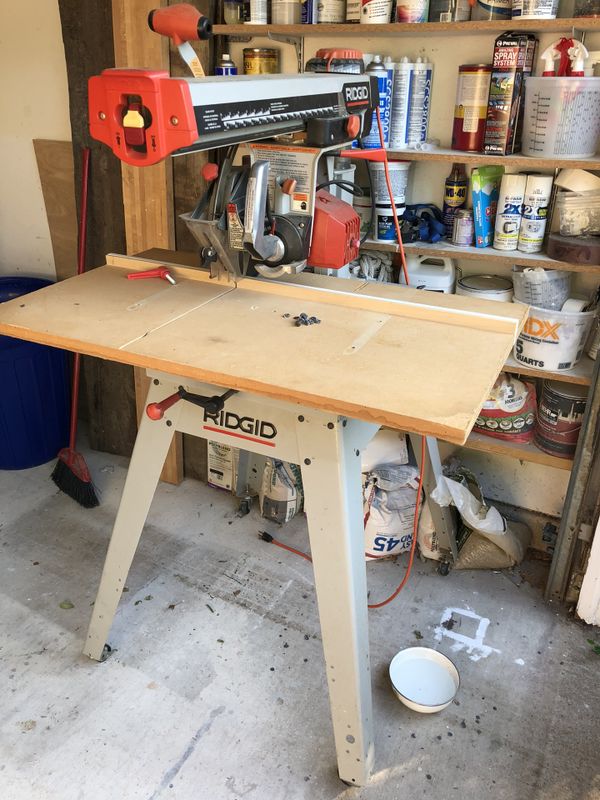
Find the location of a particular element. caulk is located at coordinates (426, 84).